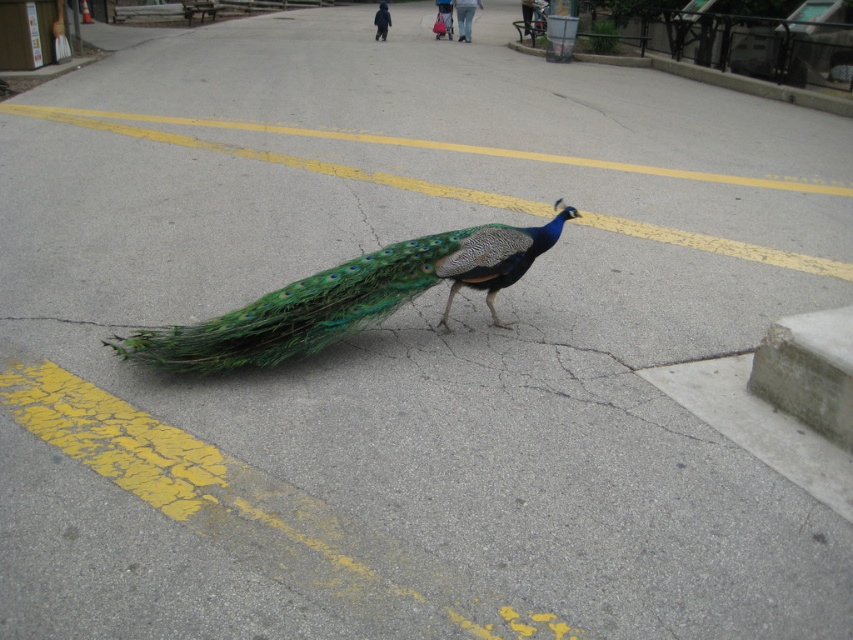
Measure the distance from green iridescent peacock at center to gray concrete curb at upper right.

15.53 meters

Can you confirm if green iridescent peacock at center is positioned to the right of gray concrete curb at upper right?

In fact, green iridescent peacock at center is to the left of gray concrete curb at upper right.

Which is behind, point (294, 301) or point (619, 60)?

Positioned behind is point (619, 60).

Where is `green iridescent peacock at center`? The height and width of the screenshot is (640, 853). green iridescent peacock at center is located at coordinates (347, 298).